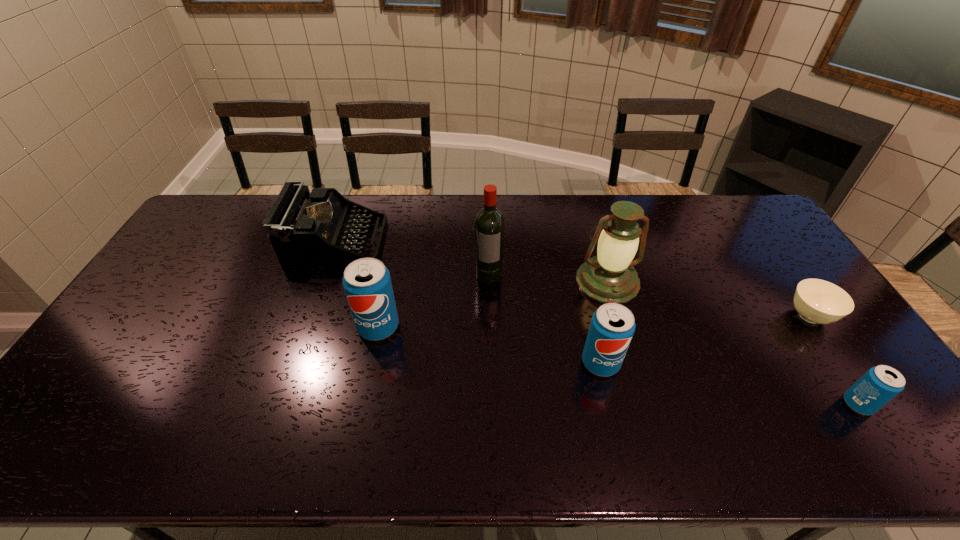
Identify the location of free space that satisfies the following two spatial constraints: 1. on the back side of the sixth tallest object; 2. on the left side of the shortest object. Image resolution: width=960 pixels, height=540 pixels. (800, 316).

At what (x,y) coordinates should I click in order to perform the action: click on vacant space that satisfies the following two spatial constraints: 1. with the light compartment facing forward on the sixth shortest object; 2. on the left side of the sugar bowl. Please return your answer as a coordinate pair (x, y). Looking at the image, I should click on (618, 316).

Where is `free space that satisfies the following two spatial constraints: 1. on the label of the shortest soda can; 2. on the right side of the third object from left to right`? free space that satisfies the following two spatial constraints: 1. on the label of the shortest soda can; 2. on the right side of the third object from left to right is located at coordinates (492, 404).

Identify the location of vacant region that satisfies the following two spatial constraints: 1. on the typing side of the typewriter; 2. on the left side of the second shortest object. (278, 404).

Locate an element on the screen. This screenshot has width=960, height=540. vacant position in the image that satisfies the following two spatial constraints: 1. on the label of the rightmost soda can; 2. on the left side of the third object from left to right is located at coordinates (492, 404).